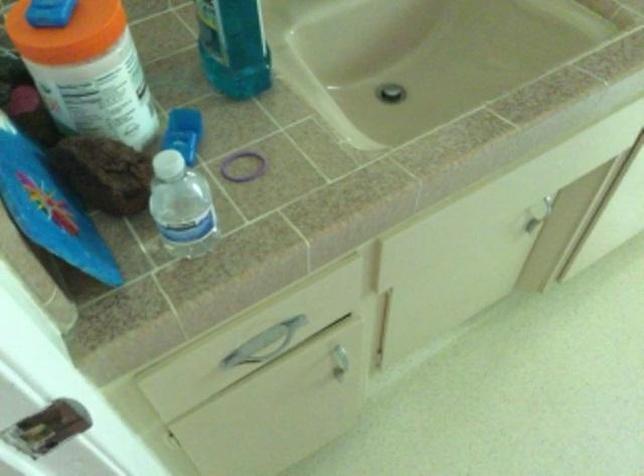
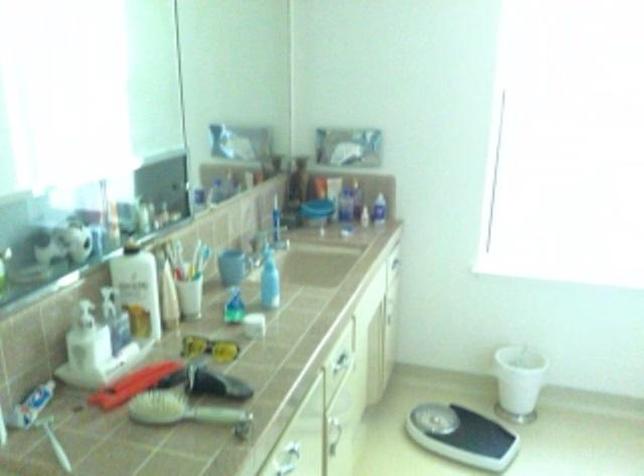
Based on the continuous images, in which direction is the camera rotating?

The camera rotated toward right-up.